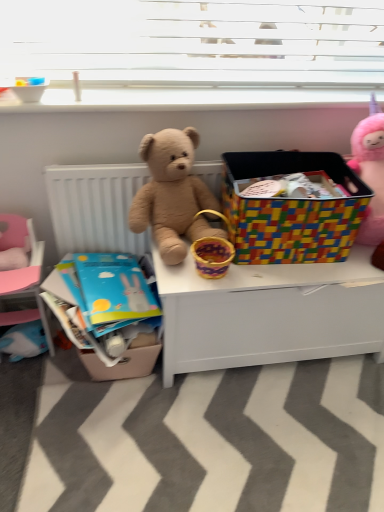
Question: Is the depth of multicolored plastic storage bin at center greater than that of fluffy pink unicorn at upper right?

Choices:
 (A) yes
 (B) no

Answer: (A)

Question: Are multicolored plastic storage bin at center and fluffy pink unicorn at upper right far apart?

Choices:
 (A) yes
 (B) no

Answer: (B)

Question: Can you confirm if multicolored plastic storage bin at center is bigger than fluffy pink unicorn at upper right?

Choices:
 (A) no
 (B) yes

Answer: (B)

Question: Could you tell me if multicolored plastic storage bin at center is facing fluffy pink unicorn at upper right?

Choices:
 (A) no
 (B) yes

Answer: (A)

Question: Does multicolored plastic storage bin at center have a greater width compared to fluffy pink unicorn at upper right?

Choices:
 (A) no
 (B) yes

Answer: (B)

Question: From a real-world perspective, relative to multicolored plastic storage bin at center, is pink fabric bed at lower left vertically above or below?

Choices:
 (A) above
 (B) below

Answer: (B)

Question: In the image, is pink fabric bed at lower left positioned in front of or behind multicolored plastic storage bin at center?

Choices:
 (A) front
 (B) behind

Answer: (B)

Question: Does point (34, 273) appear closer or farther from the camera than point (319, 157)?

Choices:
 (A) closer
 (B) farther

Answer: (A)

Question: Considering the positions of pink fabric bed at lower left and multicolored plastic storage bin at center in the image, is pink fabric bed at lower left bigger or smaller than multicolored plastic storage bin at center?

Choices:
 (A) big
 (B) small

Answer: (B)

Question: From a real-world perspective, is multicolored plastic storage bin at center positioned above or below matte cardboard crate at lower left?

Choices:
 (A) above
 (B) below

Answer: (A)

Question: In the image, is multicolored plastic storage bin at center on the left side or the right side of matte cardboard crate at lower left?

Choices:
 (A) left
 (B) right

Answer: (B)

Question: Considering the positions of multicolored plastic storage bin at center and matte cardboard crate at lower left in the image, is multicolored plastic storage bin at center wider or thinner than matte cardboard crate at lower left?

Choices:
 (A) wide
 (B) thin

Answer: (B)

Question: Does point (324, 215) appear closer or farther from the camera than point (49, 280)?

Choices:
 (A) farther
 (B) closer

Answer: (B)

Question: Based on their positions, is matte cardboard crate at lower left located to the left or right of fuzzy brown teddy bear at center?

Choices:
 (A) left
 (B) right

Answer: (A)

Question: From a real-world perspective, relative to fuzzy brown teddy bear at center, is matte cardboard crate at lower left vertically above or below?

Choices:
 (A) above
 (B) below

Answer: (B)